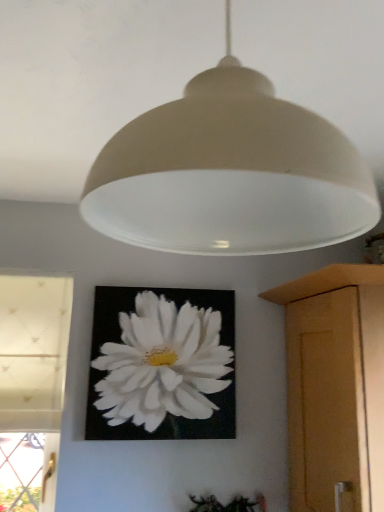
Measure the distance between point (5,288) and camera.

A distance of 4.85 feet exists between point (5,288) and camera.

At what (x,y) coordinates should I click in order to perform the action: click on wooden cabinet at right. Please return your answer as a coordinate pair (x, y). This screenshot has width=384, height=512. Looking at the image, I should click on (335, 386).

Measure the distance between green matte plant at lower center and camera.

green matte plant at lower center and camera are 4.54 feet apart.

At what (x,y) coordinates should I click in order to perform the action: click on white matte flower at center. Please return your answer as a coordinate pair (x, y). Image resolution: width=384 pixels, height=512 pixels. Looking at the image, I should click on (162, 365).

The height and width of the screenshot is (512, 384). Describe the element at coordinates (230, 173) in the screenshot. I see `matte white lampshade at upper center` at that location.

Locate an element on the screen. This screenshot has width=384, height=512. white textured fabric at left is located at coordinates (32, 383).

Looking at this image, is matte white lampshade at upper center turned away from green matte plant at lower center?

No.

How different are the orientations of matte white lampshade at upper center and green matte plant at lower center in degrees?

3.16 degrees.

From the image's perspective, which one is positioned lower, matte white lampshade at upper center or green matte plant at lower center?

green matte plant at lower center.

Who is taller, green matte plant at lower center or white matte flower at center?

white matte flower at center.

From the image's perspective, is green matte plant at lower center located above or below white matte flower at center?

green matte plant at lower center is below white matte flower at center.

Is green matte plant at lower center oriented towards white matte flower at center?

No, green matte plant at lower center is not oriented towards white matte flower at center.

Is white textured fabric at left positioned behind matte white lampshade at upper center?

Yes.

Locate an element on the screen. The height and width of the screenshot is (512, 384). window that is behind the matte white lampshade at upper center is located at coordinates (32, 383).

Which is in front, point (32, 401) or point (249, 70)?

Point (249, 70)

How distant is white textured fabric at left from matte white lampshade at upper center?

The distance of white textured fabric at left from matte white lampshade at upper center is 3.84 feet.

Does wooden cabinet at right contain matte white lampshade at upper center?

No, matte white lampshade at upper center is not a part of wooden cabinet at right.

From a real-world perspective, between wooden cabinet at right and matte white lampshade at upper center, who is vertically lower?

From a 3D spatial view, wooden cabinet at right is below.

From the image's perspective, is wooden cabinet at right above or below matte white lampshade at upper center?

wooden cabinet at right is situated lower than matte white lampshade at upper center in the image.

You are a GUI agent. You are given a task and a screenshot of the screen. Output one action in this format:
    pyautogui.click(x=<x>, y=<y>)
    Task: Click on the cabinetry below the matte white lampshade at upper center (from a real-world perspective)
    The width and height of the screenshot is (384, 512).
    Given the screenshot: What is the action you would take?
    pyautogui.click(x=335, y=386)

Measure the distance from matte white lampshade at upper center to white matte flower at center.

93.74 centimeters.

From a real-world perspective, is matte white lampshade at upper center physically above white matte flower at center?

Yes.

Who is taller, matte white lampshade at upper center or white matte flower at center?

Standing taller between the two is white matte flower at center.

Looking at this image, is matte white lampshade at upper center far away from white matte flower at center?

No, there isn't a large distance between matte white lampshade at upper center and white matte flower at center.

Considering the positions of point (208, 228) and point (55, 461), is point (208, 228) closer or farther from the camera than point (55, 461)?

Point (208, 228) is positioned closer to the camera compared to point (55, 461).

Considering the sizes of objects matte white lampshade at upper center and white textured fabric at left in the image provided, who is thinner, matte white lampshade at upper center or white textured fabric at left?

Thinner between the two is white textured fabric at left.

From a real-world perspective, is matte white lampshade at upper center positioned under white textured fabric at left based on gravity?

No, from a real-world perspective, matte white lampshade at upper center is not under white textured fabric at left.

From the picture: Looking at their sizes, would you say matte white lampshade at upper center is wider or thinner than wooden cabinet at right?

Clearly, matte white lampshade at upper center has less width compared to wooden cabinet at right.

From the picture: From the image's perspective, between matte white lampshade at upper center and wooden cabinet at right, which one is located above?

matte white lampshade at upper center.

Is matte white lampshade at upper center closer to the viewer compared to wooden cabinet at right?

Yes, the depth of matte white lampshade at upper center is less than that of wooden cabinet at right.

Locate an element on the screen. cabinetry that appears behind the matte white lampshade at upper center is located at coordinates (335, 386).

You are a GUI agent. You are given a task and a screenshot of the screen. Output one action in this format:
    pyautogui.click(x=<x>, y=<y>)
    Task: Click on the plant behind the matte white lampshade at upper center
    Image resolution: width=384 pixels, height=512 pixels.
    Given the screenshot: What is the action you would take?
    pyautogui.click(x=228, y=504)

Locate an element on the screen. The width and height of the screenshot is (384, 512). plant in front of the white matte flower at center is located at coordinates (228, 504).

Considering their positions, is white matte flower at center positioned further to green matte plant at lower center than wooden cabinet at right?

wooden cabinet at right.

Considering their positions, is white textured fabric at left positioned further to white matte flower at center than wooden cabinet at right?

wooden cabinet at right is positioned further to the anchor white matte flower at center.

When comparing their distances from matte white lampshade at upper center, does white textured fabric at left or green matte plant at lower center seem closer?

white textured fabric at left lies closer to matte white lampshade at upper center than the other object.

From the image, which object appears to be nearer to white textured fabric at left, green matte plant at lower center or white matte flower at center?

white matte flower at center lies closer to white textured fabric at left than the other object.

Based on their spatial positions, is green matte plant at lower center or wooden cabinet at right further from white textured fabric at left?

wooden cabinet at right.

Estimate the real-world distances between objects in this image. Which object is further from white matte flower at center, wooden cabinet at right or matte white lampshade at upper center?

matte white lampshade at upper center is further to white matte flower at center.

From the image, which object appears to be farther from matte white lampshade at upper center, white matte flower at center or green matte plant at lower center?

green matte plant at lower center lies further to matte white lampshade at upper center than the other object.

Looking at the image, which one is located further to white matte flower at center, matte white lampshade at upper center or green matte plant at lower center?

matte white lampshade at upper center lies further to white matte flower at center than the other object.

Where is `cabinetry between matte white lampshade at upper center and green matte plant at lower center vertically`? cabinetry between matte white lampshade at upper center and green matte plant at lower center vertically is located at coordinates (335, 386).

Where is `plant between white textured fabric at left and wooden cabinet at right from left to right`? This screenshot has height=512, width=384. plant between white textured fabric at left and wooden cabinet at right from left to right is located at coordinates (228, 504).

The width and height of the screenshot is (384, 512). Identify the location of cabinetry between matte white lampshade at upper center and white matte flower at center from front to back. (335, 386).

Identify the location of window between matte white lampshade at upper center and green matte plant at lower center from front to back. This screenshot has width=384, height=512. (32, 383).